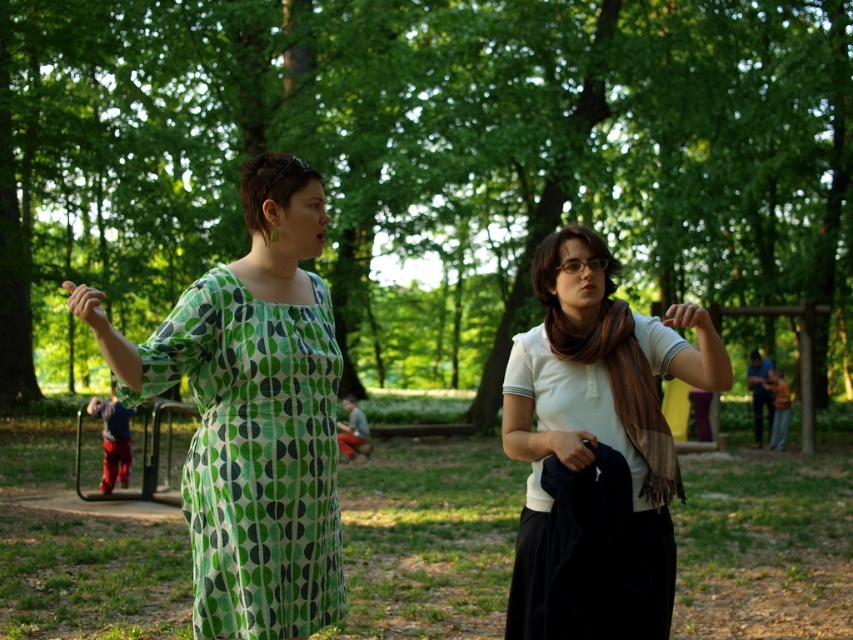
Question: Which of the following is the farthest from the observer?

Choices:
 (A) white cotton shirt at center
 (B) green dotted fabric dress at center

Answer: (B)

Question: Which object is closer to the camera taking this photo?

Choices:
 (A) green dotted fabric dress at center
 (B) white cotton shirt at center

Answer: (B)

Question: Is green dotted fabric dress at center above white cotton shirt at center?

Choices:
 (A) no
 (B) yes

Answer: (A)

Question: Which point is farther from the camera taking this photo?

Choices:
 (A) (525, 397)
 (B) (230, 464)

Answer: (A)

Question: Is green dotted fabric dress at center closer to the viewer compared to white cotton shirt at center?

Choices:
 (A) no
 (B) yes

Answer: (A)

Question: Does green dotted fabric dress at center appear on the left side of white cotton shirt at center?

Choices:
 (A) no
 (B) yes

Answer: (B)